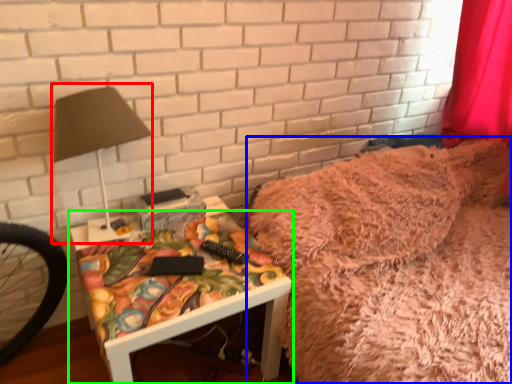
Question: Considering the real-world distances, which object is farthest from table lamp (highlighted by a red box)? bed (highlighted by a blue box) or furniture (highlighted by a green box)?

Choices:
 (A) bed
 (B) furniture

Answer: (A)